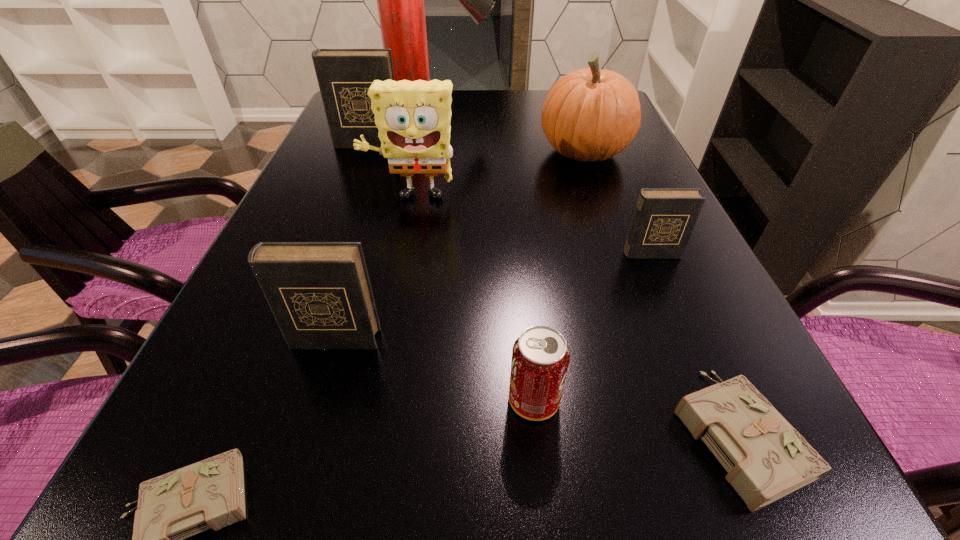
In order to click on free space located 0.230m on the front cover of the fifth tallest object in this screenshot , I will do `click(283, 513)`.

I want to click on free space located on the front cover of the smallest dark diary, so click(x=737, y=455).

I want to click on free location located 0.160m on the right of the soda can, so click(x=675, y=400).

You are a GUI agent. You are given a task and a screenshot of the screen. Output one action in this format:
    pyautogui.click(x=<x>, y=<y>)
    Task: Click on the vacant space located 0.270m on the back of the right green diary
    The width and height of the screenshot is (960, 540).
    Given the screenshot: What is the action you would take?
    pyautogui.click(x=657, y=251)

Locate an element on the screen. The height and width of the screenshot is (540, 960). object at the far edge is located at coordinates (400, 0).

Identify the location of object present at the near edge. This screenshot has height=540, width=960. (766, 458).

Where is `fire extinguisher positioned at the left edge`? The width and height of the screenshot is (960, 540). fire extinguisher positioned at the left edge is located at coordinates (400, 0).

Locate an element on the screen. The width and height of the screenshot is (960, 540). pumpkin situated at the right edge is located at coordinates (589, 114).

Find the location of `object positioned at the far left corner`. object positioned at the far left corner is located at coordinates (400, 0).

Where is `object present at the near right corner`? This screenshot has height=540, width=960. object present at the near right corner is located at coordinates (766, 458).